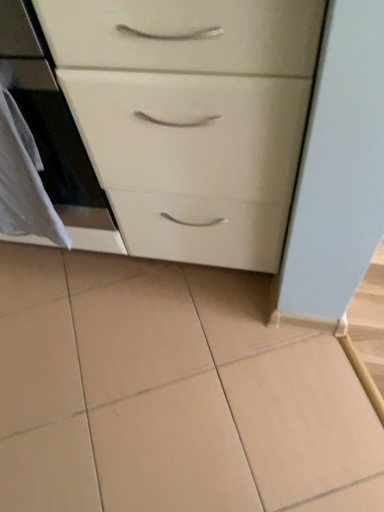
Question: Is white glossy chest of drawers at center located outside white glossy oven at left?

Choices:
 (A) no
 (B) yes

Answer: (A)

Question: From the image's perspective, would you say white glossy chest of drawers at center is positioned over white glossy oven at left?

Choices:
 (A) no
 (B) yes

Answer: (A)

Question: Considering the relative sizes of white glossy chest of drawers at center and white glossy oven at left in the image provided, is white glossy chest of drawers at center smaller than white glossy oven at left?

Choices:
 (A) yes
 (B) no

Answer: (B)

Question: Can you confirm if white glossy chest of drawers at center is shorter than white glossy oven at left?

Choices:
 (A) no
 (B) yes

Answer: (A)

Question: Does white glossy chest of drawers at center have a greater width compared to white glossy oven at left?

Choices:
 (A) no
 (B) yes

Answer: (B)

Question: Is the depth of white glossy chest of drawers at center less than that of white glossy oven at left?

Choices:
 (A) no
 (B) yes

Answer: (B)

Question: Considering the relative sizes of white fabric at left and white glossy chest of drawers at center in the image provided, is white fabric at left smaller than white glossy chest of drawers at center?

Choices:
 (A) no
 (B) yes

Answer: (B)

Question: Is white fabric at left wider than white glossy chest of drawers at center?

Choices:
 (A) no
 (B) yes

Answer: (A)

Question: Is white fabric at left facing towards white glossy chest of drawers at center?

Choices:
 (A) no
 (B) yes

Answer: (A)

Question: From the image's perspective, is white fabric at left on white glossy chest of drawers at center?

Choices:
 (A) no
 (B) yes

Answer: (A)

Question: Is white fabric at left oriented away from white glossy chest of drawers at center?

Choices:
 (A) no
 (B) yes

Answer: (B)

Question: Is white fabric at left at the right side of white glossy chest of drawers at center?

Choices:
 (A) yes
 (B) no

Answer: (B)

Question: Is white glossy chest of drawers at center positioned behind white fabric at left?

Choices:
 (A) yes
 (B) no

Answer: (B)